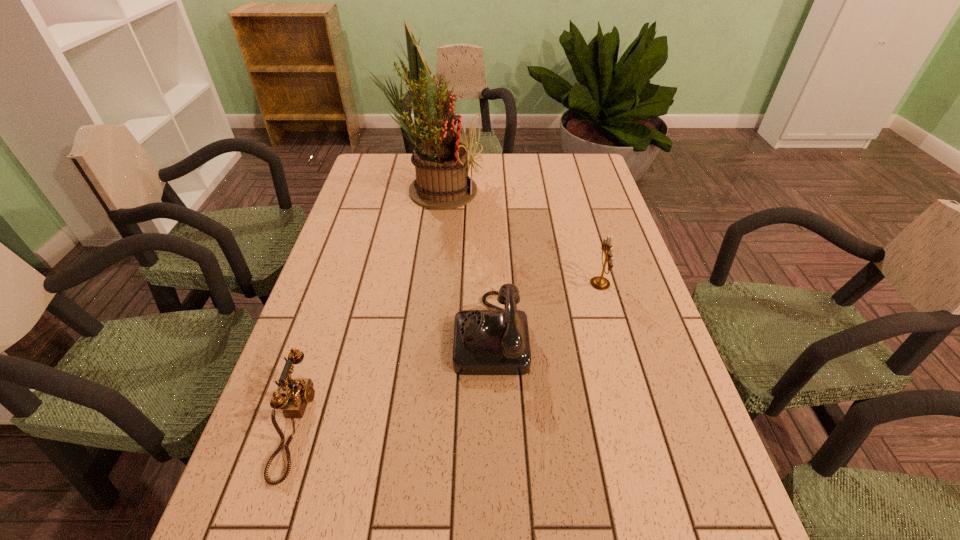
Identify the location of empty space between the shorter telephone and the tallest object. The height and width of the screenshot is (540, 960). (365, 307).

This screenshot has height=540, width=960. I want to click on unoccupied position between the right telephone and the farthest object, so click(x=463, y=261).

The image size is (960, 540). I want to click on object that stands as the third closest to the candelabrum, so click(300, 392).

Identify which object is located as the third nearest to the candelabrum. Please provide its 2D coordinates. Your answer should be formatted as a tuple, i.e. [(x, y)], where the tuple contains the x and y coordinates of a point satisfying the conditions above.

[(300, 392)]

At what (x,y) coordinates should I click in order to perform the action: click on free space that satisfies the following two spatial constraints: 1. in front of the farthest object with the fan visible; 2. on the left side of the candelabrum. Please return your answer as a coordinate pair (x, y). Looking at the image, I should click on (422, 284).

Image resolution: width=960 pixels, height=540 pixels. Identify the location of vacant position in the image that satisfies the following two spatial constraints: 1. on the front side of the second tallest object; 2. on the front-facing side of the left telephone. (640, 424).